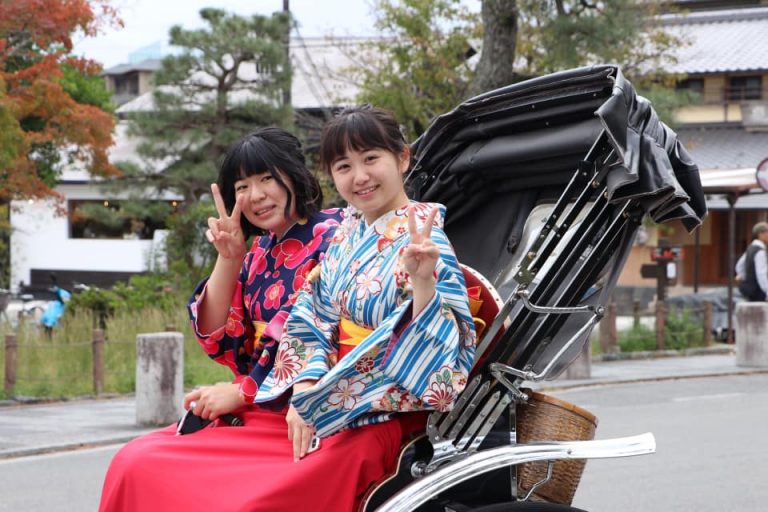
Where is `woven basket`? woven basket is located at coordinates 548,429.